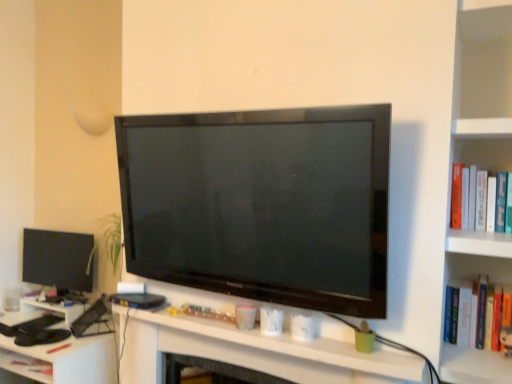
Question: Is point (73, 279) closer or farther from the camera than point (486, 208)?

Choices:
 (A) closer
 (B) farther

Answer: (B)

Question: Is matte black monitor at left in front of or behind hardcover book at right in the image?

Choices:
 (A) front
 (B) behind

Answer: (B)

Question: Estimate the real-world distances between objects in this image. Which object is farther from the hardcover book at right?

Choices:
 (A) matte black monitor at left
 (B) white plastic computer desk at lower left
 (C) matte black computer at center

Answer: (A)

Question: Estimate the real-world distances between objects in this image. Which object is farther from the matte black monitor at left?

Choices:
 (A) hardcover book at right
 (B) matte black computer at center
 (C) white plastic computer desk at lower left

Answer: (A)